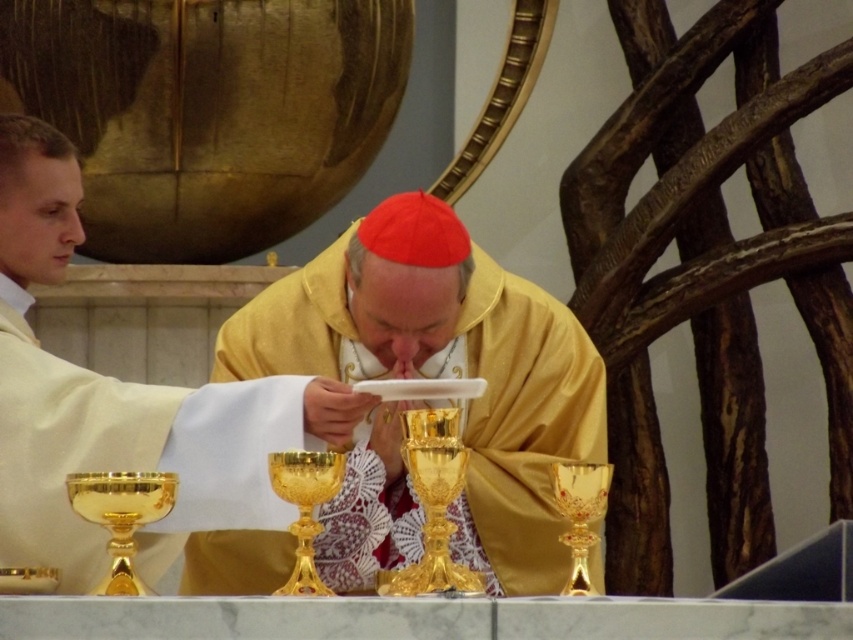
Question: Which object is farther from the camera taking this photo?

Choices:
 (A) gold satin robe at center
 (B) white matte robe at left

Answer: (A)

Question: From the image, what is the correct spatial relationship of white matte robe at left in relation to gold satin robe at center?

Choices:
 (A) left
 (B) right

Answer: (A)

Question: Does white matte robe at left appear over gold satin robe at center?

Choices:
 (A) yes
 (B) no

Answer: (A)

Question: Which object is closer to the camera taking this photo?

Choices:
 (A) white matte robe at left
 (B) gold satin robe at center

Answer: (A)

Question: Which point is closer to the camera?

Choices:
 (A) gold satin robe at center
 (B) white matte robe at left

Answer: (B)

Question: Is white matte robe at left wider than gold satin robe at center?

Choices:
 (A) yes
 (B) no

Answer: (B)